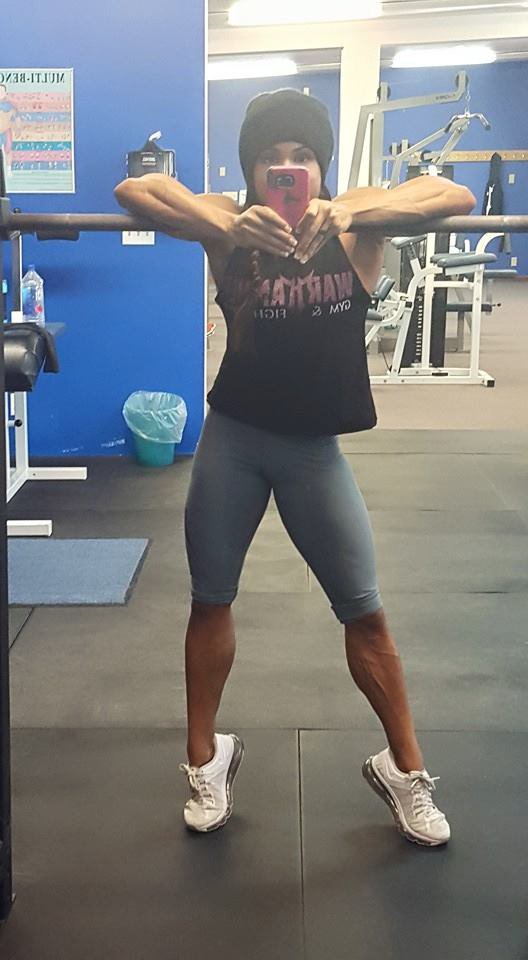
Identify the location of poster. (44, 118).